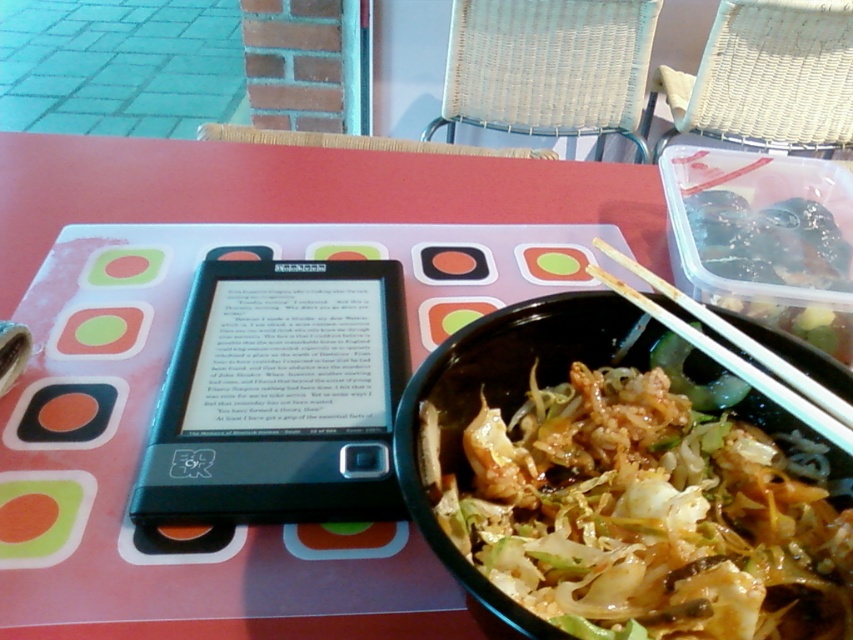
You are a server at the outdoor table and need to place a new menu on the table. The menu is 12 inches wide. The table has limited space between the black plastic bowl at lower right and the wooden chopsticks at bowl right. Can you fit the menu between them?

The black plastic bowl at lower right is wider than the wooden chopsticks at bowl right. Since the menu is 12 inches wide, you need to check the available space between them. If the distance between the edge of the bowl and the chopsticks is at least 12 inches, the menu can fit. However, without knowing the exact distance, it is uncertain.